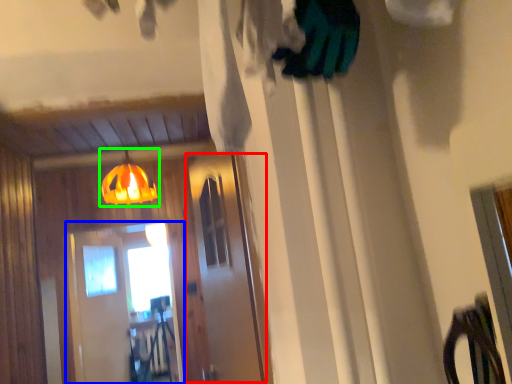
Question: Which object is positioned farthest from screen door (highlighted by a red box)? Select from screen door (highlighted by a blue box) and lamp (highlighted by a green box).

Choices:
 (A) screen door
 (B) lamp

Answer: (A)